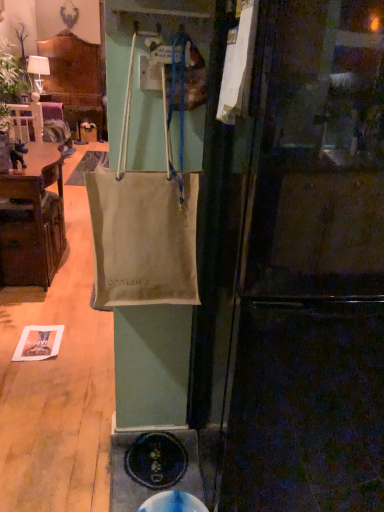
I want to click on matte white lampshade at upper left, so click(38, 70).

The height and width of the screenshot is (512, 384). What do you see at coordinates (295, 269) in the screenshot? I see `matte black refrigerator at center` at bounding box center [295, 269].

What is the approximate height of blue rubber manhole cover at lower center?

The height of blue rubber manhole cover at lower center is 3.92 inches.

What do you see at coordinates (144, 224) in the screenshot? Image resolution: width=384 pixels, height=512 pixels. I see `beige canvas bag at center` at bounding box center [144, 224].

This screenshot has width=384, height=512. Describe the element at coordinates (32, 219) in the screenshot. I see `brown wood cabinet at left` at that location.

Find the location of a particular element. This screenshot has width=384, height=512. matte white lampshade at upper left is located at coordinates (38, 70).

From the image's perspective, relative to matte black refrigerator at center, is matte white lampshade at upper left above or below?

From the image's perspective, matte white lampshade at upper left appears above matte black refrigerator at center.

Can you confirm if matte white lampshade at upper left is wider than matte black refrigerator at center?

No, matte white lampshade at upper left is not wider than matte black refrigerator at center.

Is matte white lampshade at upper left to the left of matte black refrigerator at center from the viewer's perspective?

Yes, matte white lampshade at upper left is to the left of matte black refrigerator at center.

Which object is thinner, brown wood cabinet at left or blue rubber manhole cover at lower center?

blue rubber manhole cover at lower center is thinner.

Identify the location of manhole below the brown wood cabinet at left (from a real-world perspective). click(x=173, y=503).

From the image's perspective, which is below, brown wood cabinet at left or blue rubber manhole cover at lower center?

blue rubber manhole cover at lower center is shown below in the image.

Based on the photo, would you say brown wood cabinet at left is inside or outside blue rubber manhole cover at lower center?

brown wood cabinet at left is not enclosed by blue rubber manhole cover at lower center.

Consider the image. Considering the sizes of objects matte white lampshade at upper left and beige canvas bag at center in the image provided, who is thinner, matte white lampshade at upper left or beige canvas bag at center?

Thinner between the two is beige canvas bag at center.

Considering the positions of objects matte white lampshade at upper left and beige canvas bag at center in the image provided, who is behind, matte white lampshade at upper left or beige canvas bag at center?

matte white lampshade at upper left.

Is matte white lampshade at upper left shorter than beige canvas bag at center?

Correct, matte white lampshade at upper left is not as tall as beige canvas bag at center.

Which is behind, point (42, 57) or point (169, 257)?

The point (42, 57) is farther.

From the image's perspective, is matte black refrigerator at center under matte white lampshade at upper left?

Indeed, from the image's perspective, matte black refrigerator at center is shown beneath matte white lampshade at upper left.

Does point (346, 79) come closer to viewer compared to point (46, 63)?

Yes, point (346, 79) is closer to viewer.

From the picture: From a real-world perspective, who is located higher, matte black refrigerator at center or matte white lampshade at upper left?

→ matte white lampshade at upper left.

Is matte black refrigerator at center outside of matte white lampshade at upper left?

That's correct, matte black refrigerator at center is outside of matte white lampshade at upper left.

Does brown wood cabinet at left appear on the left side of beige canvas bag at center?

Yes.

Does brown wood cabinet at left have a greater width compared to beige canvas bag at center?

Yes, brown wood cabinet at left is wider than beige canvas bag at center.

Is point (44, 182) more distant than point (156, 198)?

Yes, point (44, 182) is behind point (156, 198).

Considering the relative sizes of brown wood cabinet at left and matte white lampshade at upper left in the image provided, is brown wood cabinet at left taller than matte white lampshade at upper left?

Correct, brown wood cabinet at left is much taller as matte white lampshade at upper left.

Can you confirm if brown wood cabinet at left is smaller than matte white lampshade at upper left?

No, brown wood cabinet at left is not smaller than matte white lampshade at upper left.

Which point is more forward, [20,254] or [39,68]?

Positioned in front is point [20,254].

In the scene shown: Is matte white lampshade at upper left a part of brown wood cabinet at left?

No, matte white lampshade at upper left is not a part of brown wood cabinet at left.

From a real-world perspective, is matte black refrigerator at center above or below beige canvas bag at center?

Clearly, from a real-world perspective, matte black refrigerator at center is below beige canvas bag at center.

Would you say beige canvas bag at center is part of matte black refrigerator at center's contents?

No, beige canvas bag at center is not surrounded by matte black refrigerator at center.

Consider the image. From the image's perspective, which one is positioned higher, matte black refrigerator at center or beige canvas bag at center?

beige canvas bag at center.

Consider the image. Considering the sizes of matte black refrigerator at center and beige canvas bag at center in the image, is matte black refrigerator at center taller or shorter than beige canvas bag at center?

Clearly, matte black refrigerator at center is taller compared to beige canvas bag at center.

The image size is (384, 512). In order to click on refrigerator below the matte white lampshade at upper left (from a real-world perspective) in this screenshot , I will do `click(295, 269)`.

Image resolution: width=384 pixels, height=512 pixels. Identify the location of cabinetry above the blue rubber manhole cover at lower center (from the image's perspective). (32, 219).

From the image, which object appears to be nearer to matte white lampshade at upper left, matte black refrigerator at center or brown wood cabinet at left?

The object closer to matte white lampshade at upper left is brown wood cabinet at left.

Looking at the image, which one is located closer to blue rubber manhole cover at lower center, matte black refrigerator at center or matte white lampshade at upper left?

Based on the image, matte black refrigerator at center appears to be nearer to blue rubber manhole cover at lower center.

Which object lies nearer to the anchor point blue rubber manhole cover at lower center, beige canvas bag at center or brown wood cabinet at left?

Based on the image, beige canvas bag at center appears to be nearer to blue rubber manhole cover at lower center.

Considering their positions, is matte white lampshade at upper left positioned closer to brown wood cabinet at left than beige canvas bag at center?

beige canvas bag at center lies closer to brown wood cabinet at left than the other object.

Based on their spatial positions, is blue rubber manhole cover at lower center or matte white lampshade at upper left closer to brown wood cabinet at left?

Based on the image, matte white lampshade at upper left appears to be nearer to brown wood cabinet at left.

Which object lies nearer to the anchor point matte white lampshade at upper left, blue rubber manhole cover at lower center or beige canvas bag at center?

beige canvas bag at center lies closer to matte white lampshade at upper left than the other object.

Looking at the image, which one is located closer to blue rubber manhole cover at lower center, matte white lampshade at upper left or beige canvas bag at center?

Among the two, beige canvas bag at center is located nearer to blue rubber manhole cover at lower center.

Which object lies further to the anchor point blue rubber manhole cover at lower center, beige canvas bag at center or matte white lampshade at upper left?

The object further to blue rubber manhole cover at lower center is matte white lampshade at upper left.

Locate an element on the screen. This screenshot has height=512, width=384. cabinetry between beige canvas bag at center and matte white lampshade at upper left in the front-back direction is located at coordinates (32, 219).

I want to click on manhole between matte black refrigerator at center and matte white lampshade at upper left along the z-axis, so click(173, 503).

Identify the location of refrigerator between beige canvas bag at center and blue rubber manhole cover at lower center in the up-down direction. The height and width of the screenshot is (512, 384). (295, 269).

Locate an element on the screen. manhole located between beige canvas bag at center and matte white lampshade at upper left in the depth direction is located at coordinates (173, 503).